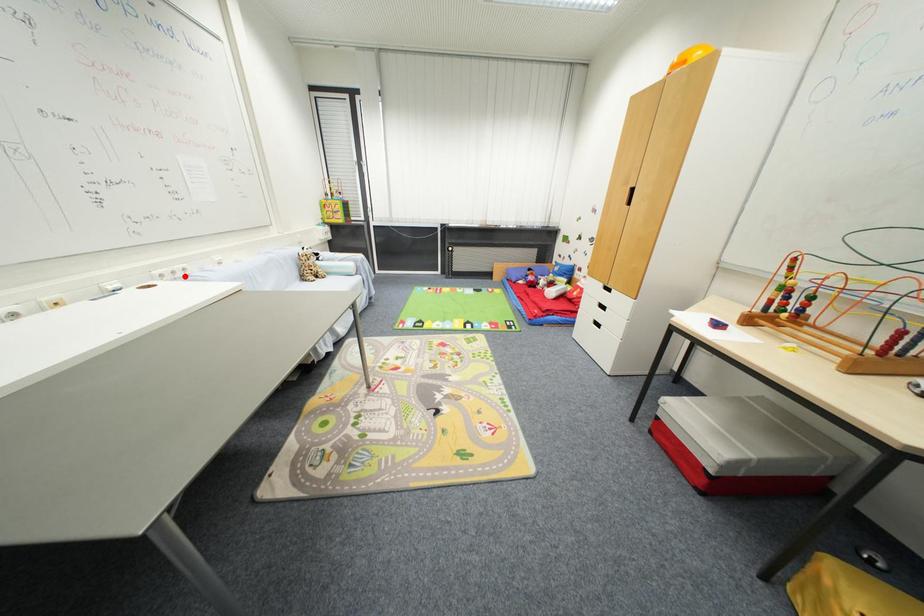
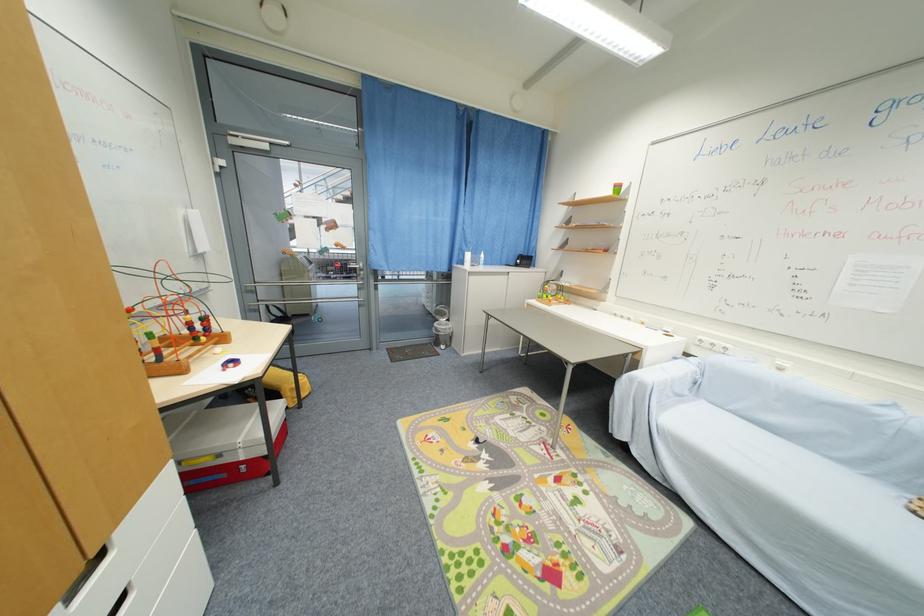
Find the pixel in the second image that matches the highlighted location in the first image.

(723, 351)